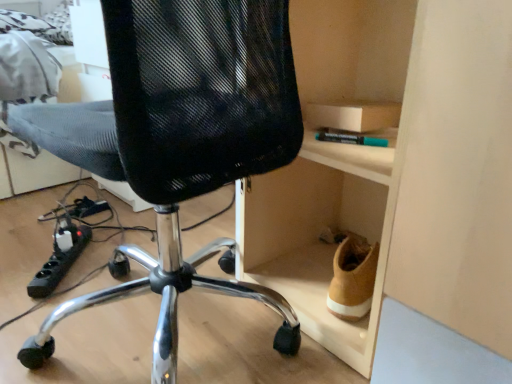
Image resolution: width=512 pixels, height=384 pixels. I want to click on wooden cabinet at right, so click(x=332, y=167).

Looking at this image, from a real-world perspective, is black mesh chair at center on black plastic power strip at lower left?

Indeed, from a real-world perspective, black mesh chair at center stands above black plastic power strip at lower left.

Does black mesh chair at center touch black plastic power strip at lower left?

There is a gap between black mesh chair at center and black plastic power strip at lower left.

Can you tell me how much black mesh chair at center and black plastic power strip at lower left differ in facing direction?

They differ by 135 degrees in their facing directions.

Between black mesh chair at center and black plastic power strip at lower left, which one has more height?

black mesh chair at center.

In terms of height, does wooden cabinet at right look taller or shorter compared to black mesh chair at center?

Clearly, wooden cabinet at right is taller compared to black mesh chair at center.

Measure the distance between wooden cabinet at right and black mesh chair at center.

wooden cabinet at right is 10.01 inches from black mesh chair at center.

Is wooden cabinet at right wider or thinner than black mesh chair at center?

wooden cabinet at right is thinner than black mesh chair at center.

From a real-world perspective, is wooden cabinet at right beneath black mesh chair at center?

Actually, wooden cabinet at right is physically above black mesh chair at center in the real world.

Considering the sizes of objects black plastic power strip at lower left and black mesh chair at center in the image provided, who is shorter, black plastic power strip at lower left or black mesh chair at center?

With less height is black plastic power strip at lower left.

Is black plastic power strip at lower left not inside black mesh chair at center?

black plastic power strip at lower left lies outside black mesh chair at center's area.

Based on the photo, could you tell me if black plastic power strip at lower left is turned towards black mesh chair at center?

Yes.

I want to click on cabinet above the black plastic power strip at lower left (from a real-world perspective), so click(332, 167).

Is black plastic power strip at lower left oriented towards wooden cabinet at right?

No, black plastic power strip at lower left is not turned towards wooden cabinet at right.

How many degrees apart are the facing directions of black plastic power strip at lower left and wooden cabinet at right?

They differ by 48.5 degrees in their facing directions.

How many degrees apart are the facing directions of black mesh chair at center and wooden cabinet at right?

86.2 degrees separate the facing orientations of black mesh chair at center and wooden cabinet at right.

What are the coordinates of `cabinet that is behind the black mesh chair at center` in the screenshot? It's located at (332, 167).

Looking at this image, is black mesh chair at center facing away from wooden cabinet at right?

No, black mesh chair at center is not facing the opposite direction of wooden cabinet at right.

From a real-world perspective, which object rests below the other?

black mesh chair at center, from a real-world perspective.

From a real-world perspective, which object rests below the other?

black plastic power strip at lower left is physically lower.

Is wooden cabinet at right positioned in front of black plastic power strip at lower left?

Yes, the depth of wooden cabinet at right is less than that of black plastic power strip at lower left.

Where is `equipment that appears below the wooden cabinet at right (from a real-world perspective)`? equipment that appears below the wooden cabinet at right (from a real-world perspective) is located at coordinates (60, 259).

Considering the points (296, 220) and (42, 268), which point is behind, point (296, 220) or point (42, 268)?

The point (296, 220) is behind.

Find the location of a particular element. The height and width of the screenshot is (384, 512). equipment that appears below the black mesh chair at center (from the image's perspective) is located at coordinates (60, 259).

In order to click on cabinet above the black mesh chair at center (from the image's perspective) in this screenshot , I will do `click(332, 167)`.

Which object lies nearer to the anchor point black mesh chair at center, wooden cabinet at right or black plastic power strip at lower left?

wooden cabinet at right is closer to black mesh chair at center.

From the image, which object appears to be nearer to black plastic power strip at lower left, wooden cabinet at right or black mesh chair at center?

Based on the image, black mesh chair at center appears to be nearer to black plastic power strip at lower left.

When comparing their distances from wooden cabinet at right, does black mesh chair at center or black plastic power strip at lower left seem closer?

black mesh chair at center is closer to wooden cabinet at right.

Considering their positions, is black plastic power strip at lower left positioned closer to wooden cabinet at right than black mesh chair at center?

Among the two, black mesh chair at center is located nearer to wooden cabinet at right.

In the scene shown: Looking at the image, which one is located further to black plastic power strip at lower left, black mesh chair at center or wooden cabinet at right?

Among the two, wooden cabinet at right is located further to black plastic power strip at lower left.

Considering their positions, is black plastic power strip at lower left positioned closer to black mesh chair at center than wooden cabinet at right?

Among the two, wooden cabinet at right is located nearer to black mesh chair at center.

Locate an element on the screen. The image size is (512, 384). chair located between black plastic power strip at lower left and wooden cabinet at right in the left-right direction is located at coordinates (192, 140).